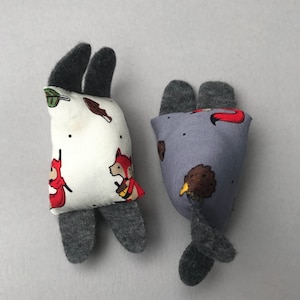
This screenshot has width=300, height=300. Identify the location of cloth covering. (207, 149), (103, 146).